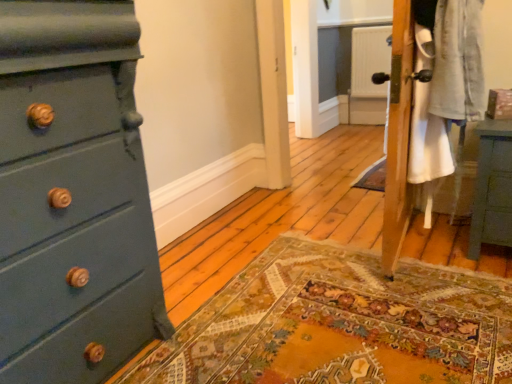
Question: Is matte teal dresser at left closer to camera compared to teal painted wood nightstand at right?

Choices:
 (A) no
 (B) yes

Answer: (B)

Question: Can you confirm if matte teal dresser at left is taller than teal painted wood nightstand at right?

Choices:
 (A) no
 (B) yes

Answer: (B)

Question: Is matte teal dresser at left wider than teal painted wood nightstand at right?

Choices:
 (A) yes
 (B) no

Answer: (A)

Question: Does matte teal dresser at left appear on the left side of teal painted wood nightstand at right?

Choices:
 (A) yes
 (B) no

Answer: (A)

Question: Considering the relative sizes of matte teal dresser at left and teal painted wood nightstand at right in the image provided, is matte teal dresser at left thinner than teal painted wood nightstand at right?

Choices:
 (A) yes
 (B) no

Answer: (B)

Question: Considering the relative sizes of matte teal dresser at left and teal painted wood nightstand at right in the image provided, is matte teal dresser at left smaller than teal painted wood nightstand at right?

Choices:
 (A) yes
 (B) no

Answer: (B)

Question: Is the depth of teal painted wood nightstand at right greater than that of matte teal dresser at left?

Choices:
 (A) yes
 (B) no

Answer: (A)

Question: Considering the relative sizes of teal painted wood nightstand at right and matte teal dresser at left in the image provided, is teal painted wood nightstand at right thinner than matte teal dresser at left?

Choices:
 (A) yes
 (B) no

Answer: (A)

Question: Does teal painted wood nightstand at right have a larger size compared to matte teal dresser at left?

Choices:
 (A) yes
 (B) no

Answer: (B)

Question: Is teal painted wood nightstand at right positioned before matte teal dresser at left?

Choices:
 (A) yes
 (B) no

Answer: (B)

Question: Is matte teal dresser at left surrounded by teal painted wood nightstand at right?

Choices:
 (A) no
 (B) yes

Answer: (A)

Question: Considering the relative sizes of teal painted wood nightstand at right and matte teal dresser at left in the image provided, is teal painted wood nightstand at right shorter than matte teal dresser at left?

Choices:
 (A) no
 (B) yes

Answer: (B)

Question: Is matte teal dresser at left inside or outside of teal painted wood nightstand at right?

Choices:
 (A) outside
 (B) inside

Answer: (A)